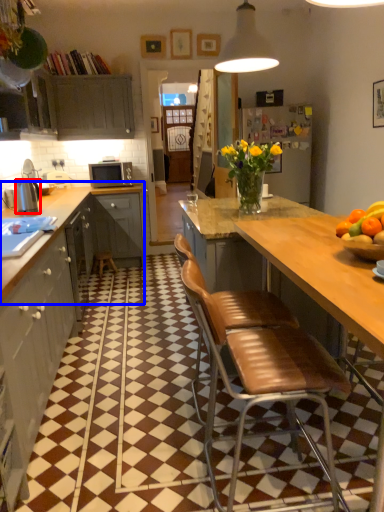
Question: Which of the following is the farthest to the observer, kitchen appliance (highlighted by a red box) or cabinetry (highlighted by a blue box)?

Choices:
 (A) kitchen appliance
 (B) cabinetry

Answer: (B)